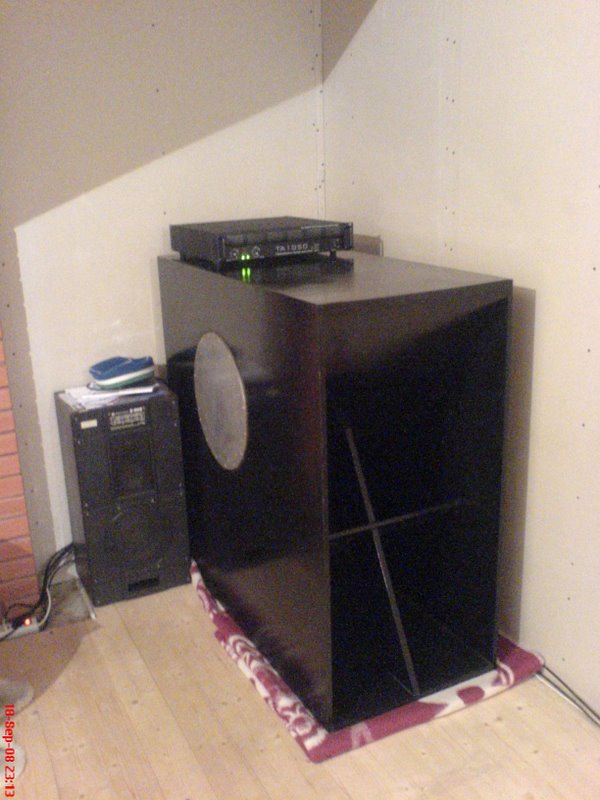
Where is `light purple part of wall`? light purple part of wall is located at coordinates (435, 105), (136, 261).